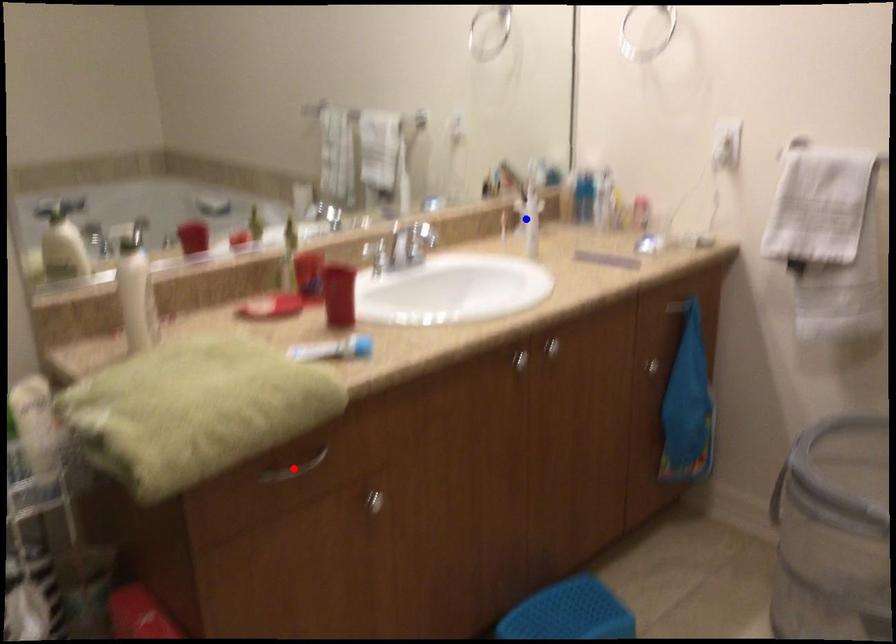
Question: In the image, two points are highlighted. Which point is nearer to the camera? Reply with the corresponding letter.

Choices:
 (A) blue point
 (B) red point

Answer: (B)